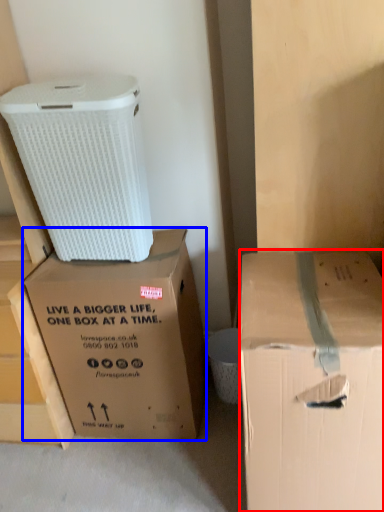
Question: Which point is closer to the camera, box (highlighted by a red box) or box (highlighted by a blue box)?

Choices:
 (A) box
 (B) box

Answer: (A)